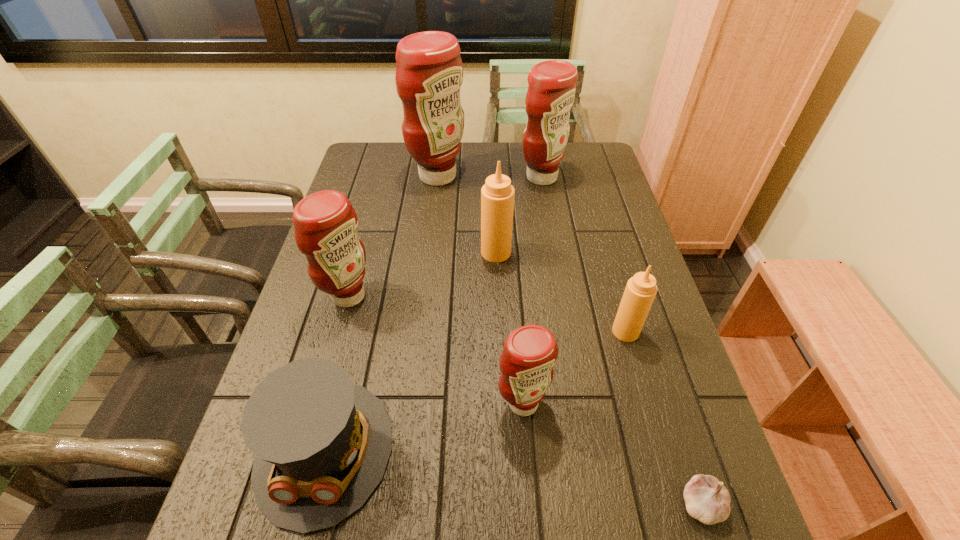
Point out which object is positioned as the seventh nearest to the second shortest object. Please provide its 2D coordinates. Your answer should be formatted as a tuple, i.e. [(x, y)], where the tuple contains the x and y coordinates of a point satisfying the conditions above.

[(551, 92)]

Choose which condiment is the nearest neighbor to the shortest object. Please provide its 2D coordinates. Your answer should be formatted as a tuple, i.e. [(x, y)], where the tuple contains the x and y coordinates of a point satisfying the conditions above.

[(530, 352)]

Image resolution: width=960 pixels, height=540 pixels. I want to click on condiment that is the second closest to the tallest condiment, so click(x=497, y=195).

The width and height of the screenshot is (960, 540). Find the location of `the third closest red condiment to the nearer tan condiment`. the third closest red condiment to the nearer tan condiment is located at coordinates pyautogui.click(x=325, y=222).

Choose which red condiment is the nearest neighbor to the tallest object. Please provide its 2D coordinates. Your answer should be formatted as a tuple, i.e. [(x, y)], where the tuple contains the x and y coordinates of a point satisfying the conditions above.

[(551, 92)]

You are a GUI agent. You are given a task and a screenshot of the screen. Output one action in this format:
    pyautogui.click(x=<x>, y=<y>)
    Task: Click on the free location that satisfies the following two spatial constraints: 1. on the back side of the third red condiment from right to left; 2. on the left side of the third biggest red condiment
    
    Given the screenshot: What is the action you would take?
    pyautogui.click(x=382, y=176)